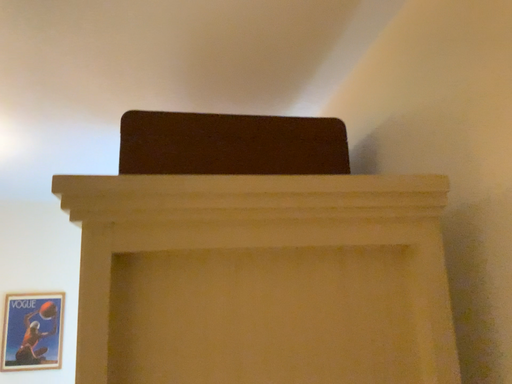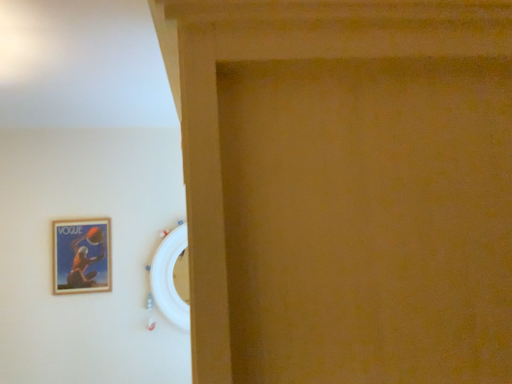
Question: Which way did the camera rotate in the video?

Choices:
 (A) rotated downward
 (B) rotated upward

Answer: (A)